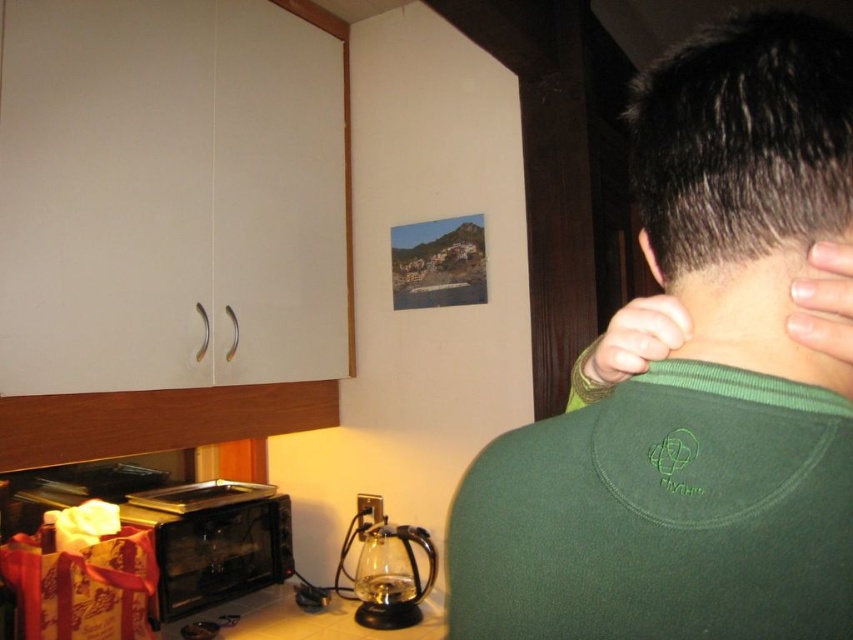
Question: Which object is positioned farthest from the green fabric hand at upper right?

Choices:
 (A) green matte neck at center
 (B) green fleece sweater at upper right
 (C) pale skin at back
 (D) black glass microwave at lower left

Answer: (D)

Question: Can you confirm if green fleece sweater at upper right is positioned to the left of dark brown hair at upper right?

Choices:
 (A) no
 (B) yes

Answer: (B)

Question: Is green matte shirt at upper right thinner than pale skin at back?

Choices:
 (A) no
 (B) yes

Answer: (A)

Question: Is green fleece sweater at upper right positioned before green matte neck at center?

Choices:
 (A) yes
 (B) no

Answer: (A)

Question: Based on their relative distances, which object is farther from the green matte neck at center?

Choices:
 (A) green fabric hand at upper right
 (B) black glass microwave at lower left
 (C) dark brown hair at upper right
 (D) green fleece sweater at upper right

Answer: (B)

Question: Which point is closer to the camera?

Choices:
 (A) (637, 358)
 (B) (776, 368)
 (C) (264, 497)

Answer: (B)